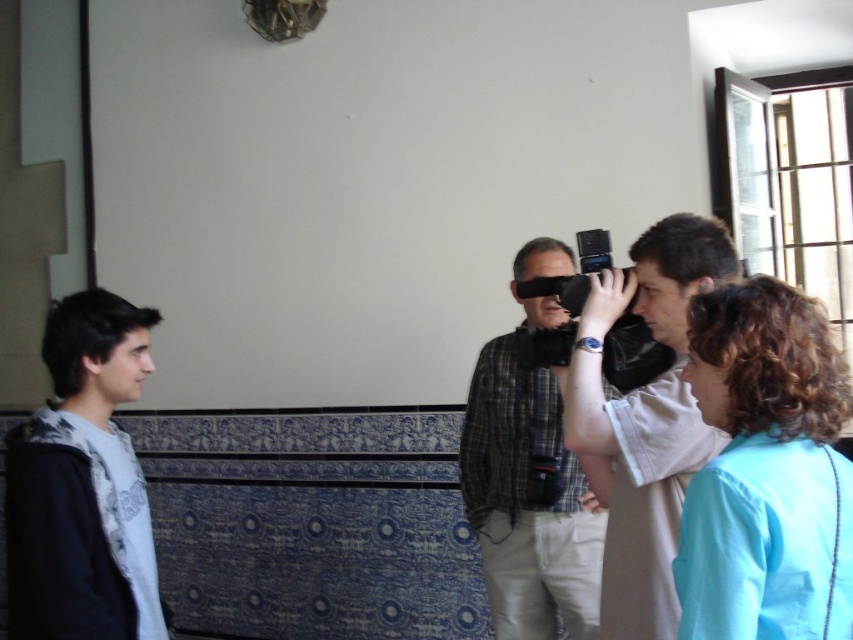
You are standing in the room with the blue and white tiled walls and you see the light blue fabric at lower right and the light gray hoodie at left. Which object is closer to you?

The light blue fabric at lower right is closer to you because it is in front of the light gray hoodie at left.

You are standing in a room with a tiled wall and see two points marked in the scene. The first point is at coordinates point (84, 445) and the second is at point (604, 301). Which point is closer to you?

Point (84, 445) is closer to you because it is further to the viewer than point (604, 301).